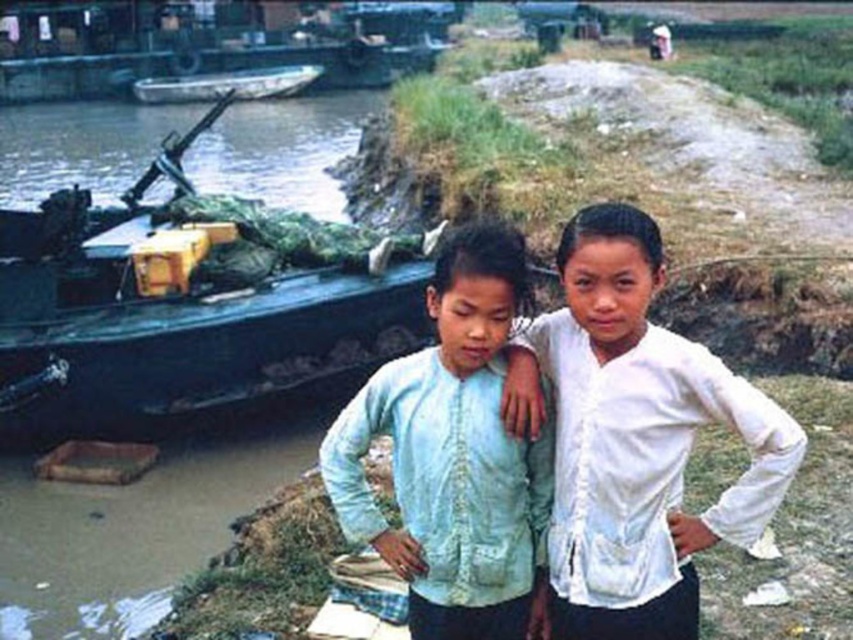
Does light blue fabric shirt at center appear on the right side of metallic gray boat at upper left?

Correct, you'll find light blue fabric shirt at center to the right of metallic gray boat at upper left.

Between light blue fabric shirt at center and metallic gray boat at upper left, which one has less height?

light blue fabric shirt at center

What do you see at coordinates (453, 458) in the screenshot? I see `light blue fabric shirt at center` at bounding box center [453, 458].

Image resolution: width=853 pixels, height=640 pixels. I want to click on light blue fabric shirt at center, so tap(453, 458).

Can you confirm if green camouflage boat at left is positioned above light blue fabric shirt at center?

Yes, green camouflage boat at left is above light blue fabric shirt at center.

Which of these two, green camouflage boat at left or light blue fabric shirt at center, stands taller?

Standing taller between the two is light blue fabric shirt at center.

Between point (230, 352) and point (352, 513), which one is positioned behind?

The point (230, 352) is more distant.

The image size is (853, 640). Find the location of `green camouflage boat at left`. green camouflage boat at left is located at coordinates (184, 317).

Can you confirm if white matte shirt at center is positioned to the left of metallic gray boat at upper left?

Incorrect, white matte shirt at center is not on the left side of metallic gray boat at upper left.

Is point (569, 513) farther from viewer compared to point (224, 74)?

No, (569, 513) is closer to viewer.

Who is more forward, (785,433) or (260,92)?

Point (785,433) is in front.

This screenshot has width=853, height=640. What are the coordinates of `white matte shirt at center` in the screenshot? It's located at (634, 436).